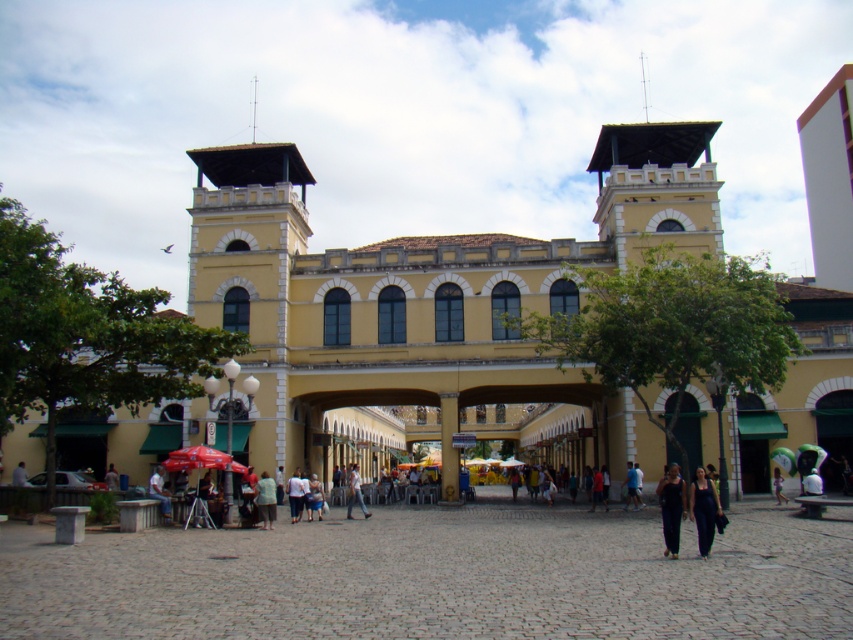
You are standing at the entrance of the building and want to reach the light blue jeans at center. There is a light brown wooden chair at lower left blocking your path. Can you walk around it without getting too close? Explain your reasoning.

The light brown wooden chair at lower left is 16.68 meters away from the light blue jeans at center. Since the distance is quite large, you can easily walk around the chair while maintaining a safe distance from it to reach the jeans.

You are standing in the marketplace under the archway of the building. You see two pairs of clothing items on display. The first is dark blue fabric pants at lower right and the second is light blue jeans at center. Which clothing item is positioned higher relative to the other?

The dark blue fabric pants at lower right is positioned higher than the light blue jeans at center.

You are a photographer standing in front of the historic building. You notice two pieces of clothing in the scene. The dark blue fabric pants at lower right and the light blue jeans at center. Which one would you focus on if you want to capture the larger item in your shot?

The dark blue fabric pants at lower right has a larger size compared to the light blue jeans at center, so focusing on the dark blue fabric pants at lower right would capture the larger item.